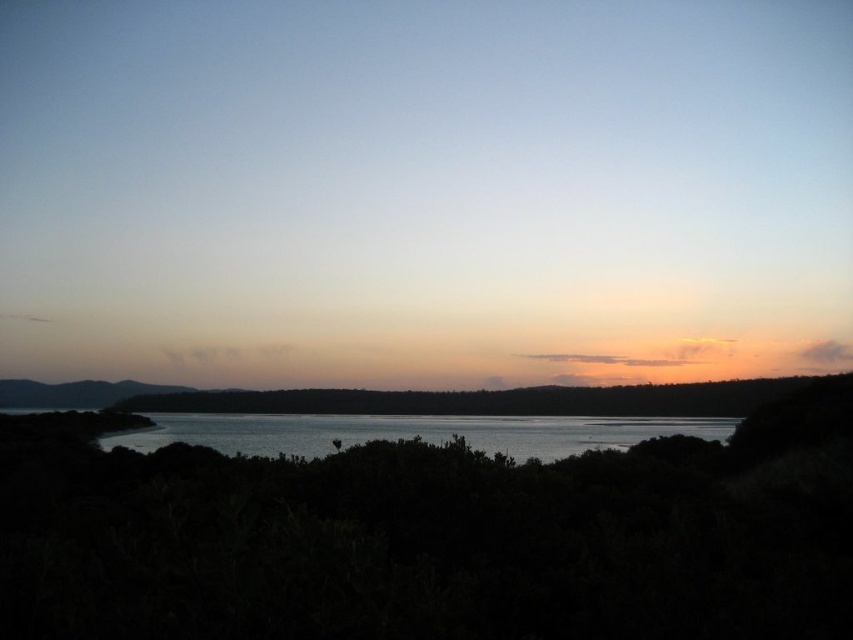
You are standing at the point marked as point (410, 433) in the image. What do you see around you?

You are standing at point (410, 433), which corresponds to glistening silver water at center. So, around you, you would see the glistening silver water at center.

You are standing at the camera position observing the landscape. There are two points marked in the image, point (161, 420) and point (685, 403). Which point is nearer to you?

Point (161, 420) is closer to the camera than point (685, 403).